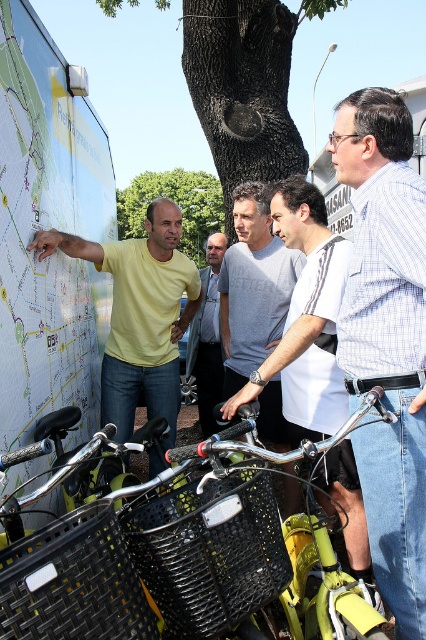
Can you confirm if white cotton shirt at center is bigger than yellow matte shirt at left?

Incorrect, white cotton shirt at center is not larger than yellow matte shirt at left.

Can you confirm if white cotton shirt at center is positioned to the right of yellow matte shirt at left?

Yes, white cotton shirt at center is to the right of yellow matte shirt at left.

Does point (308, 294) come in front of point (164, 278)?

Yes, point (308, 294) is closer to viewer.

Where is `white cotton shirt at center`? Image resolution: width=426 pixels, height=640 pixels. white cotton shirt at center is located at coordinates (305, 320).

Measure the distance from white paper map at left to green rough bark tree at center.

white paper map at left and green rough bark tree at center are 13.08 feet apart from each other.

Can you confirm if white paper map at left is thinner than green rough bark tree at center?

No.

Which is behind, point (80, 230) or point (262, 120)?

Positioned behind is point (262, 120).

Locate an element on the screen. The image size is (426, 640). white paper map at left is located at coordinates (46, 228).

Between point (132, 531) and point (287, 300), which one is positioned in front?

Point (132, 531) is more forward.

Who is more distant from viewer, (183, 449) or (222, 269)?

The point (222, 269) is behind.

Is point (120, 550) positioned before point (261, 198)?

That is True.

Find the location of a particular element. This screenshot has height=640, width=426. black plastic basket at center is located at coordinates (172, 557).